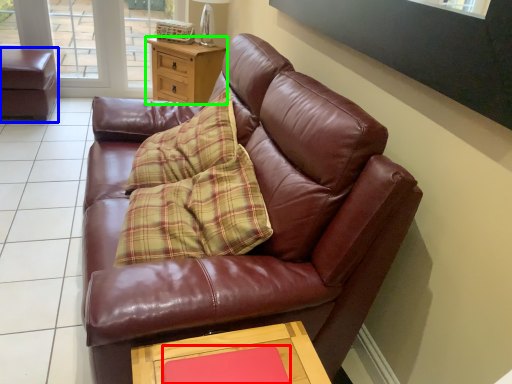
Question: Which is nearer to the flat (highlighted by a red box)? swivel chair (highlighted by a blue box) or side table (highlighted by a green box).

Choices:
 (A) swivel chair
 (B) side table

Answer: (B)